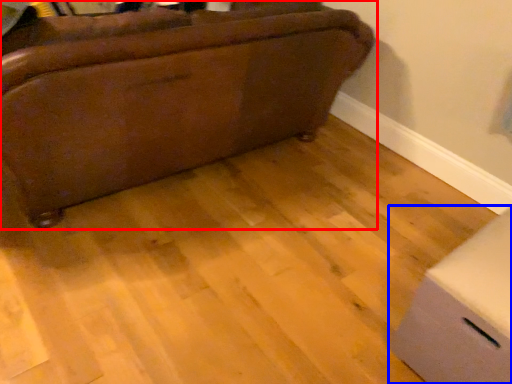
Question: Among these objects, which one is farthest to the camera, furniture (highlighted by a red box) or cardboard box (highlighted by a blue box)?

Choices:
 (A) furniture
 (B) cardboard box

Answer: (A)